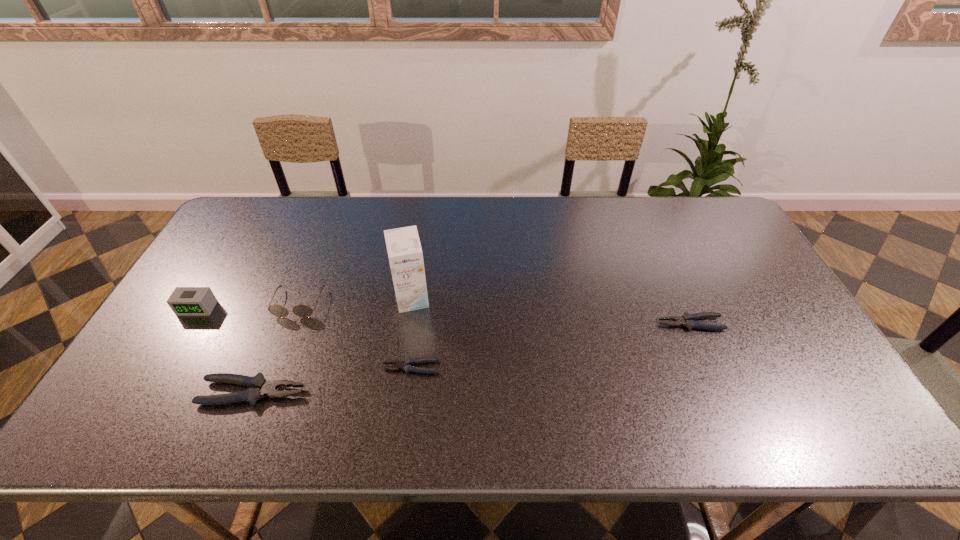
Find the location of `the third shortest object`. the third shortest object is located at coordinates (261, 387).

Locate an element on the screen. This screenshot has width=960, height=540. the nearest object is located at coordinates (261, 387).

At what (x,y) coordinates should I click in order to perform the action: click on the shortest pliers. Please return your answer as a coordinate pair (x, y). The height and width of the screenshot is (540, 960). Looking at the image, I should click on (405, 365).

Locate an element on the screen. the shortest object is located at coordinates (405, 365).

Locate an element on the screen. The image size is (960, 540). the rightmost object is located at coordinates (687, 320).

The height and width of the screenshot is (540, 960). I want to click on the second shortest pliers, so click(687, 320).

In order to click on alarm clock in this screenshot , I will do `click(184, 301)`.

Locate an element on the screen. sunglasses is located at coordinates (303, 311).

The image size is (960, 540). Find the location of `carton`. carton is located at coordinates (404, 250).

Find the location of a particular element. The width and height of the screenshot is (960, 540). vacant space situated at the gripping part of the nearest pliers is located at coordinates (371, 392).